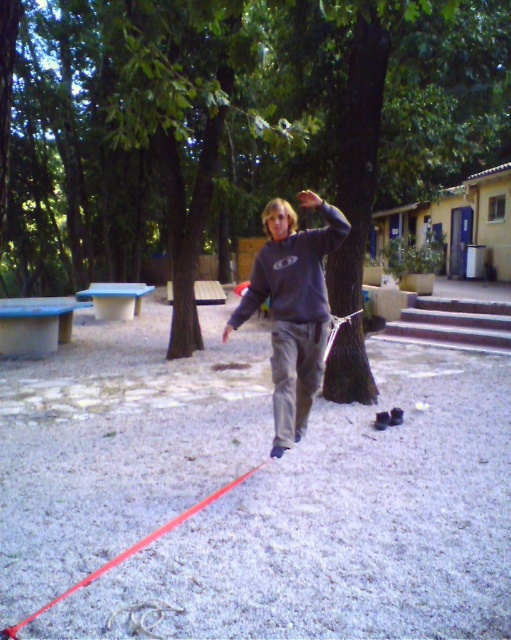
You are planning to install a new flagpole in the park where the green leafy tree at center and the matte gray sweatshirt at center are located. Considering their heights, which object would require a taller flagpole to ensure the flag is visible above both?

The green leafy tree at center is much taller than the matte gray sweatshirt at center, so the flagpole needs to be taller than the green leafy tree at center to ensure visibility above both.

You are planning to take a photo of the green leafy tree at center and the matte gray sweatshirt at center. Which object should you zoom in more on to ensure both are clearly visible in the frame?

The green leafy tree at center is larger in size than the matte gray sweatshirt at center, so you should zoom in more on the green leafy tree at center to ensure both are clearly visible in the frame.

Based on the coordinates provided, where is the green leafy tree at center located in the image?

The green leafy tree at center is located at the coordinates point (233, 124).